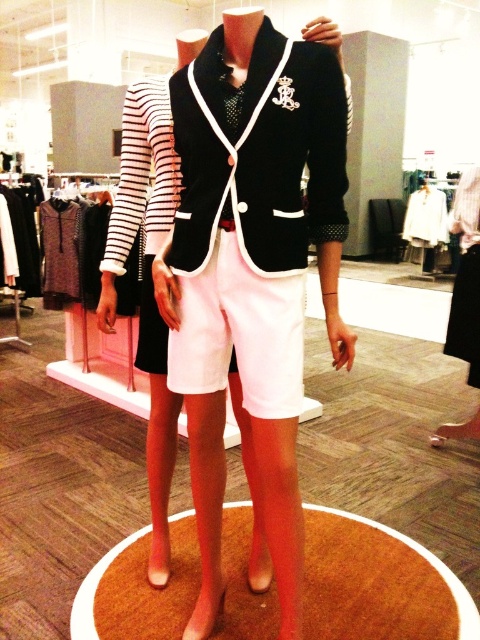
Looking at this image, you are a customer in a clothing store and see the velvet black blazer at center and the white cotton shorts at center displayed together. Which item is taller?

The velvet black blazer at center is much taller than the white cotton shorts at center.

You are a store employee who needs to place a 4 inch wide decorative ribbon between the satin black blazer at center and the velvet black blazer at center. Can you fit the ribbon between them without overlapping either blazer?

The satin black blazer at center is 3.75 inches from the velvet black blazer at center. Since the ribbon is 4 inches wide, it cannot fit between them without overlapping either blazer.